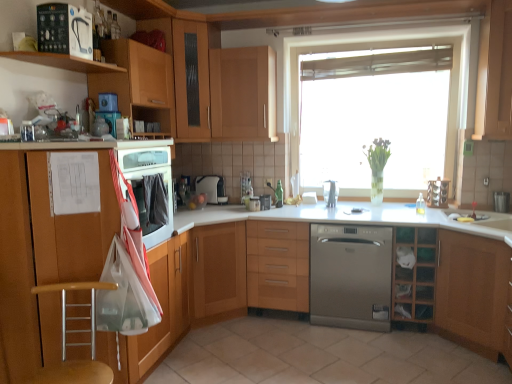
I want to click on free space in front of metallic silver toaster at center, positioned as the 1th appliance in left-to-right order, so click(256, 213).